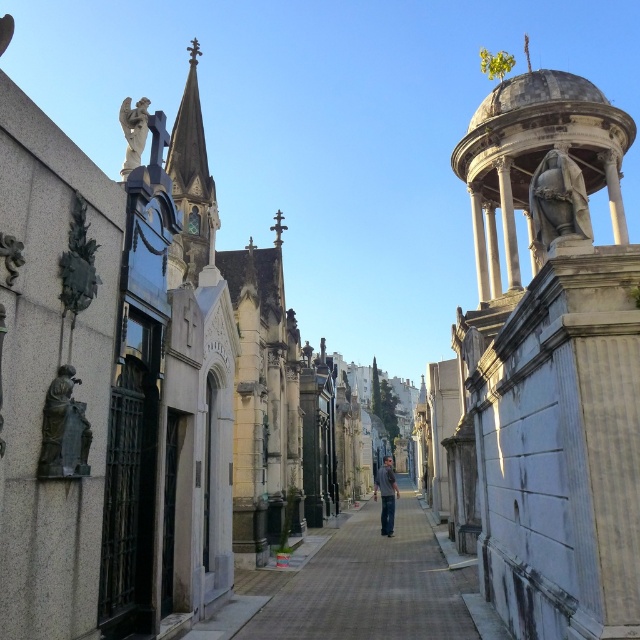
Based on the photo, you are a tour guide explaining the cemetery to visitors. You mention both the white marble statue at upper center and the polished stone statue at right. Which statue is larger in size?

The white marble statue at upper center is bigger than the polished stone statue at right.

You are a visitor exploring the cemetery and want to take a photo of both the polished stone statue at right and the bronze statue at left. Which statue should you stand closer to in order to capture both in a single frame without zooming?

You should stand closer to the bronze statue at left because it is smaller than the polished stone statue at right, allowing both to fit in the frame when positioned nearer to the smaller statue.